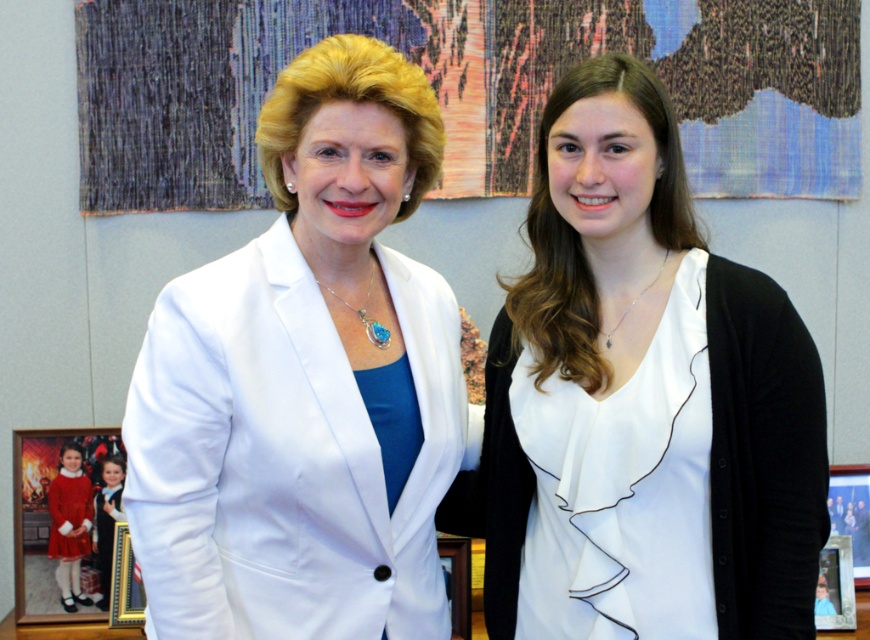
Question: Is white matte blouse at center smaller than white smooth blazer at center?

Choices:
 (A) no
 (B) yes

Answer: (B)

Question: Among these objects, which one is nearest to the camera?

Choices:
 (A) white smooth blazer at center
 (B) white matte blouse at center

Answer: (A)

Question: Does white matte blouse at center appear on the right side of white smooth blazer at center?

Choices:
 (A) no
 (B) yes

Answer: (B)

Question: Can you confirm if white matte blouse at center is positioned to the right of white smooth blazer at center?

Choices:
 (A) no
 (B) yes

Answer: (B)